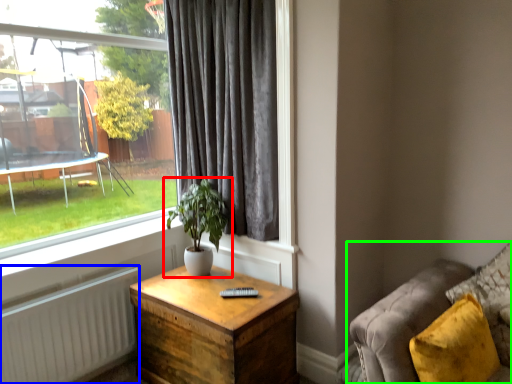
Question: Which object is the closest to the houseplant (highlighted by a red box)? Choose among these: radiator (highlighted by a blue box) or studio couch (highlighted by a green box).

Choices:
 (A) radiator
 (B) studio couch

Answer: (A)